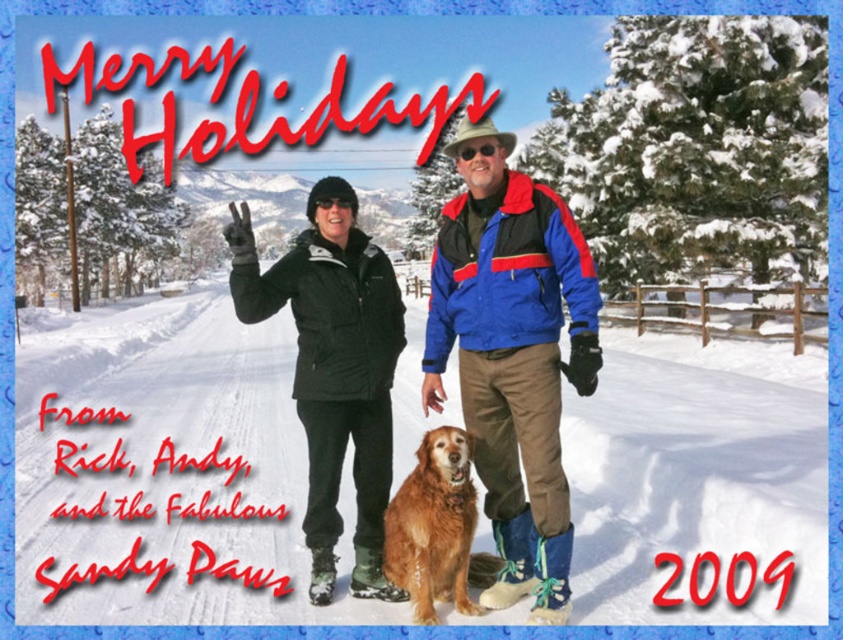
Between point (492, 202) and point (428, 472), which one is positioned in front?

Point (428, 472) is more forward.

Can you confirm if matte black jacket at center is bigger than golden fur dog at center?

Indeed, matte black jacket at center has a larger size compared to golden fur dog at center.

Measure the distance between point (478, 198) and camera.

Point (478, 198) is 5.06 meters away from camera.

The width and height of the screenshot is (843, 640). I want to click on matte black jacket at center, so click(513, 353).

Can you confirm if blue/red/black jacket at center is positioned below golden fur dog at center?

Actually, blue/red/black jacket at center is above golden fur dog at center.

Who is lower down, blue/red/black jacket at center or golden fur dog at center?

golden fur dog at center is below.

Describe the element at coordinates (513, 355) in the screenshot. I see `blue/red/black jacket at center` at that location.

This screenshot has height=640, width=843. I want to click on blue/red/black jacket at center, so click(513, 355).

How far apart are black nylon jacket at center and golden fur dog at center?

60.87 centimeters

Between black nylon jacket at center and golden fur dog at center, which one has more height?

golden fur dog at center is taller.

Image resolution: width=843 pixels, height=640 pixels. Describe the element at coordinates (333, 369) in the screenshot. I see `black nylon jacket at center` at that location.

Locate an element on the screen. This screenshot has width=843, height=640. black nylon jacket at center is located at coordinates (333, 369).